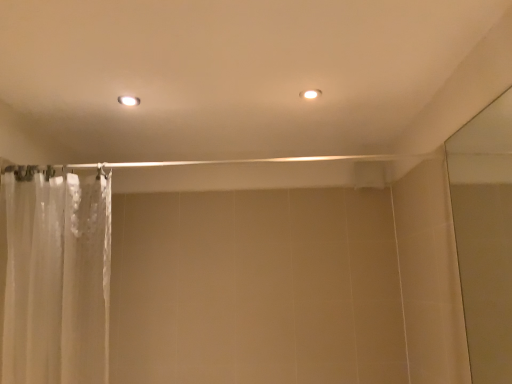
What is the approximate height of clear plastic curtain at left?

It is 34.64 inches.

Describe the element at coordinates (56, 277) in the screenshot. I see `clear plastic curtain at left` at that location.

Locate an element on the screen. clear plastic curtain at left is located at coordinates (56, 277).

Where is `clear plastic curtain at left`? Image resolution: width=512 pixels, height=384 pixels. clear plastic curtain at left is located at coordinates pyautogui.click(x=56, y=277).